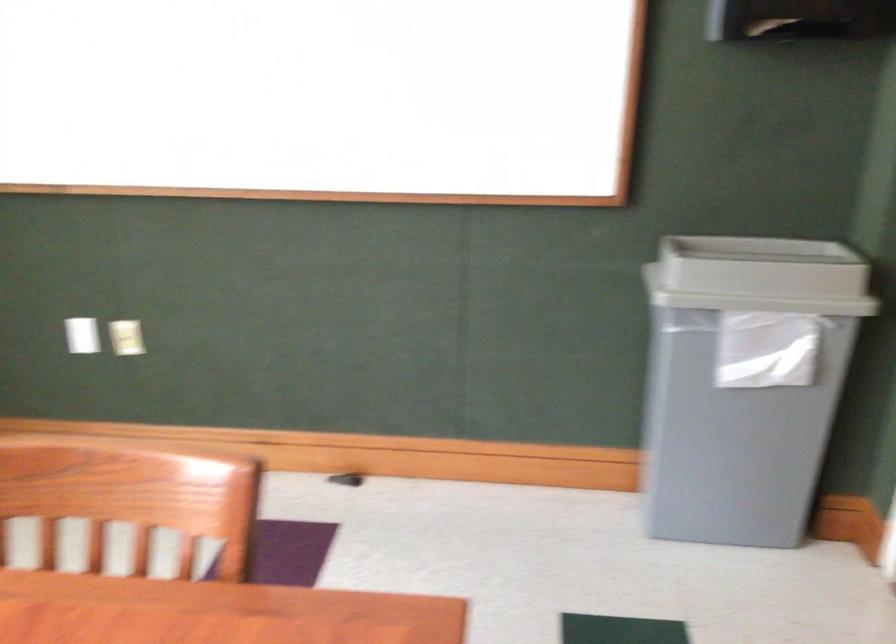
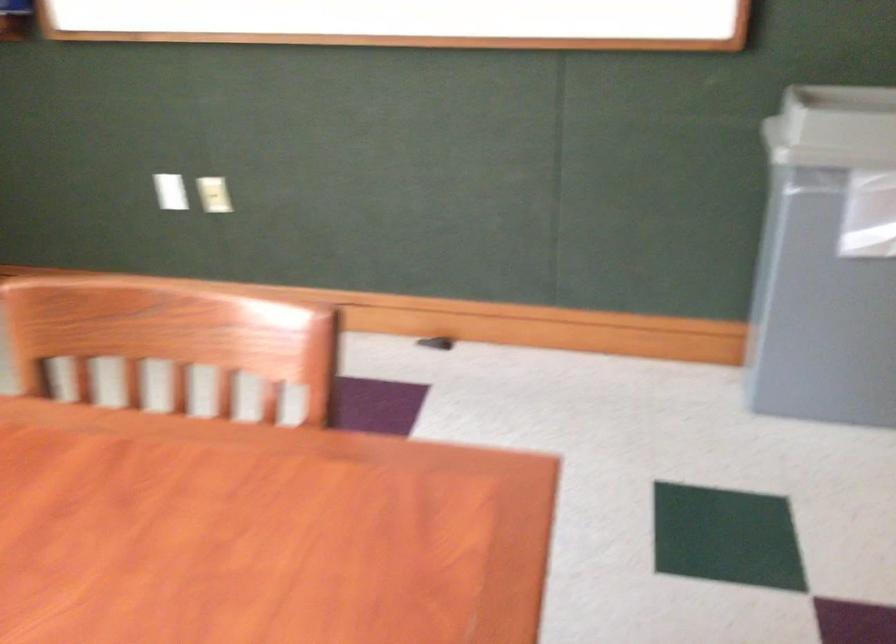
Question: How did the camera likely rotate?

Choices:
 (A) Left
 (B) Right
 (C) Up
 (D) Down

Answer: (D)